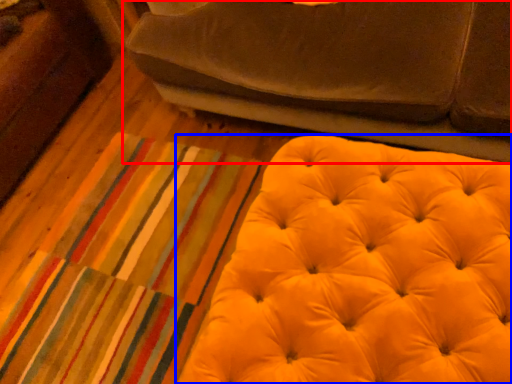
Question: Which object appears farthest to the camera in this image, studio couch (highlighted by a red box) or furniture (highlighted by a blue box)?

Choices:
 (A) studio couch
 (B) furniture

Answer: (A)